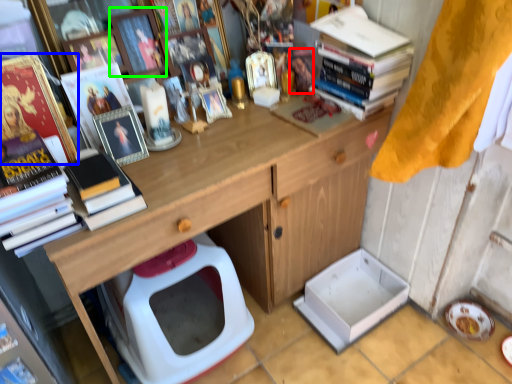
Question: Considering the real-world distances, which object is closest to toy (highlighted by a red box)? book (highlighted by a blue box) or picture frame (highlighted by a green box).

Choices:
 (A) book
 (B) picture frame

Answer: (B)